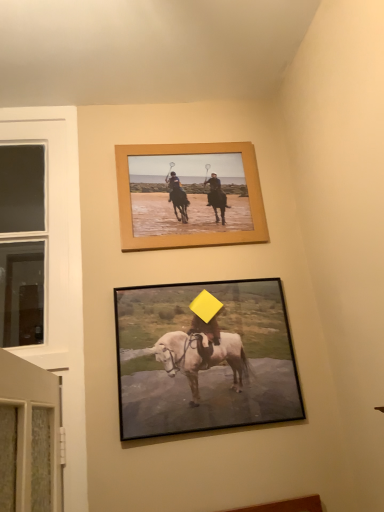
Where is `wooden frame at upper center, positioned as the 1th picture frame in top-to-bottom order`? wooden frame at upper center, positioned as the 1th picture frame in top-to-bottom order is located at coordinates (189, 195).

Image resolution: width=384 pixels, height=512 pixels. What do you see at coordinates (189, 195) in the screenshot?
I see `wooden frame at upper center, positioned as the 1th picture frame in top-to-bottom order` at bounding box center [189, 195].

Image resolution: width=384 pixels, height=512 pixels. What do you see at coordinates (204, 358) in the screenshot?
I see `matte black horse at center, the second picture frame viewed from the top` at bounding box center [204, 358].

What are the coordinates of `matte black horse at center, the 1th picture frame from the front` in the screenshot? It's located at (204, 358).

The width and height of the screenshot is (384, 512). I want to click on wooden frame at upper center, which is the first picture frame from back to front, so click(189, 195).

Considering the relative positions of matte black horse at center, which is the first picture frame from bottom to top, and wooden frame at upper center, acting as the second picture frame starting from the bottom, in the image provided, is matte black horse at center, which is the first picture frame from bottom to top, to the right of wooden frame at upper center, acting as the second picture frame starting from the bottom, from the viewer's perspective?

Yes, matte black horse at center, which is the first picture frame from bottom to top, is to the right of wooden frame at upper center, acting as the second picture frame starting from the bottom.

Is matte black horse at center, which is the first picture frame from bottom to top, further to camera compared to wooden frame at upper center, acting as the second picture frame starting from the bottom?

No, it is in front of wooden frame at upper center, acting as the second picture frame starting from the bottom.

Is point (196, 415) positioned in front of point (145, 193)?

Yes, point (196, 415) is closer to viewer.

From the image's perspective, is matte black horse at center, the 1th picture frame from the front, on top of wooden frame at upper center, which is the first picture frame from back to front?

No, from the image's perspective, matte black horse at center, the 1th picture frame from the front, is not over wooden frame at upper center, which is the first picture frame from back to front.

From a real-world perspective, between matte black horse at center, the 1th picture frame from the front, and wooden frame at upper center, acting as the second picture frame starting from the bottom, who is vertically higher?

wooden frame at upper center, acting as the second picture frame starting from the bottom, from a real-world perspective.

Considering the relative sizes of matte black horse at center, the 1th picture frame from the front, and wooden frame at upper center, which is the first picture frame from back to front, in the image provided, is matte black horse at center, the 1th picture frame from the front, thinner than wooden frame at upper center, which is the first picture frame from back to front,?

No.

Between matte black horse at center, which is the 2th picture frame from back to front, and wooden frame at upper center, which is the first picture frame from back to front, which one has less height?

Standing shorter between the two is wooden frame at upper center, which is the first picture frame from back to front.

Looking at the image, does matte black horse at center, which is the 2th picture frame from back to front, seem bigger or smaller compared to wooden frame at upper center, which is counted as the 2th picture frame, starting from the front?

matte black horse at center, which is the 2th picture frame from back to front, is bigger than wooden frame at upper center, which is counted as the 2th picture frame, starting from the front.

Could wooden frame at upper center, which is counted as the 2th picture frame, starting from the front, be considered to be inside matte black horse at center, which is the 2th picture frame from back to front?

No, wooden frame at upper center, which is counted as the 2th picture frame, starting from the front, is located outside of matte black horse at center, which is the 2th picture frame from back to front.

Does matte black horse at center, the second picture frame viewed from the top, touch wooden frame at upper center, acting as the second picture frame starting from the bottom?

No, matte black horse at center, the second picture frame viewed from the top, is not with wooden frame at upper center, acting as the second picture frame starting from the bottom.

Is matte black horse at center, the 1th picture frame from the front, oriented away from wooden frame at upper center, which is the first picture frame from back to front?

No, matte black horse at center, the 1th picture frame from the front, is not facing away from wooden frame at upper center, which is the first picture frame from back to front.

How many degrees apart are the facing directions of matte black horse at center, the 1th picture frame from the front, and wooden frame at upper center, which is the first picture frame from back to front?

0.721 degrees.

Find the location of a particular element. The image size is (384, 512). picture frame below the wooden frame at upper center, which is the first picture frame from back to front (from a real-world perspective) is located at coordinates (204, 358).

Considering the positions of objects wooden frame at upper center, which is the first picture frame from back to front, and matte black horse at center, the 1th picture frame from the front, in the image provided, who is more to the right, wooden frame at upper center, which is the first picture frame from back to front, or matte black horse at center, the 1th picture frame from the front,?

Positioned to the right is matte black horse at center, the 1th picture frame from the front.

Is the position of wooden frame at upper center, positioned as the 1th picture frame in top-to-bottom order, less distant than that of matte black horse at center, which is the 2th picture frame from back to front?

No, it is behind matte black horse at center, which is the 2th picture frame from back to front.

Is point (166, 180) positioned in front of point (156, 398)?

No, (166, 180) is behind (156, 398).

From the image's perspective, is wooden frame at upper center, which is counted as the 2th picture frame, starting from the front, on top of matte black horse at center, the 1th picture frame from the front?

Yes, from the image's perspective, wooden frame at upper center, which is counted as the 2th picture frame, starting from the front, is over matte black horse at center, the 1th picture frame from the front.

From a real-world perspective, is wooden frame at upper center, which is the first picture frame from back to front, above or below matte black horse at center, which is the 2th picture frame from back to front?

wooden frame at upper center, which is the first picture frame from back to front, is situated higher than matte black horse at center, which is the 2th picture frame from back to front, in the real world.

From the picture: Which of these two, wooden frame at upper center, positioned as the 1th picture frame in top-to-bottom order, or matte black horse at center, the 1th picture frame from the front, is thinner?

wooden frame at upper center, positioned as the 1th picture frame in top-to-bottom order.

In the scene shown: Is wooden frame at upper center, which is the first picture frame from back to front, taller or shorter than matte black horse at center, the 1th picture frame from the front?

wooden frame at upper center, which is the first picture frame from back to front, is shorter than matte black horse at center, the 1th picture frame from the front.

Between wooden frame at upper center, which is counted as the 2th picture frame, starting from the front, and matte black horse at center, which is the first picture frame from bottom to top, which one has larger size?

Bigger between the two is matte black horse at center, which is the first picture frame from bottom to top.

Is wooden frame at upper center, acting as the second picture frame starting from the bottom, not inside matte black horse at center, which is the 2th picture frame from back to front?

Absolutely, wooden frame at upper center, acting as the second picture frame starting from the bottom, is external to matte black horse at center, which is the 2th picture frame from back to front.

Based on the photo, is wooden frame at upper center, acting as the second picture frame starting from the bottom, far away from matte black horse at center, the 1th picture frame from the front?

No, wooden frame at upper center, acting as the second picture frame starting from the bottom, is not far from matte black horse at center, the 1th picture frame from the front.

Is wooden frame at upper center, positioned as the 1th picture frame in top-to-bottom order, oriented away from matte black horse at center, the 1th picture frame from the front?

No, wooden frame at upper center, positioned as the 1th picture frame in top-to-bottom order, is not facing the opposite direction of matte black horse at center, the 1th picture frame from the front.

Find the location of a particular element. The height and width of the screenshot is (512, 384). picture frame below the wooden frame at upper center, acting as the second picture frame starting from the bottom (from a real-world perspective) is located at coordinates (204, 358).

Identify the location of picture frame on the left side of matte black horse at center, which is the 2th picture frame from back to front. (189, 195).

The width and height of the screenshot is (384, 512). I want to click on picture frame that appears in front of the wooden frame at upper center, which is counted as the 2th picture frame, starting from the front, so click(x=204, y=358).